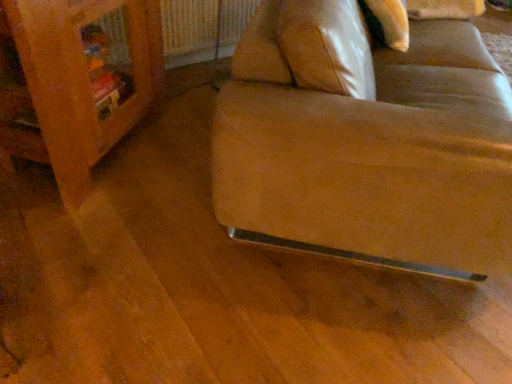
Question: Can you confirm if wooden bookshelf at left is smaller than metallic silver radiator at upper center?

Choices:
 (A) no
 (B) yes

Answer: (A)

Question: Is wooden bookshelf at left turned away from metallic silver radiator at upper center?

Choices:
 (A) no
 (B) yes

Answer: (A)

Question: From the image's perspective, is wooden bookshelf at left located beneath metallic silver radiator at upper center?

Choices:
 (A) yes
 (B) no

Answer: (A)

Question: Is wooden bookshelf at left not near metallic silver radiator at upper center?

Choices:
 (A) yes
 (B) no

Answer: (B)

Question: From a real-world perspective, does wooden bookshelf at left sit lower than metallic silver radiator at upper center?

Choices:
 (A) no
 (B) yes

Answer: (A)

Question: Is wooden bookshelf at left bigger than metallic silver radiator at upper center?

Choices:
 (A) no
 (B) yes

Answer: (B)

Question: Can you confirm if wooden bookshelf at left is taller than leather at lower right?

Choices:
 (A) yes
 (B) no

Answer: (B)

Question: Considering the relative positions of wooden bookshelf at left and leather at lower right in the image provided, is wooden bookshelf at left in front of leather at lower right?

Choices:
 (A) no
 (B) yes

Answer: (A)

Question: From the image's perspective, would you say wooden bookshelf at left is positioned over leather at lower right?

Choices:
 (A) no
 (B) yes

Answer: (A)

Question: Can you confirm if wooden bookshelf at left is bigger than leather at lower right?

Choices:
 (A) yes
 (B) no

Answer: (B)

Question: Is wooden bookshelf at left positioned with its back to leather at lower right?

Choices:
 (A) yes
 (B) no

Answer: (B)

Question: From a real-world perspective, is wooden bookshelf at left positioned over leather at lower right based on gravity?

Choices:
 (A) yes
 (B) no

Answer: (B)

Question: From a real-world perspective, does metallic silver radiator at upper center stand above leather at lower right?

Choices:
 (A) no
 (B) yes

Answer: (A)